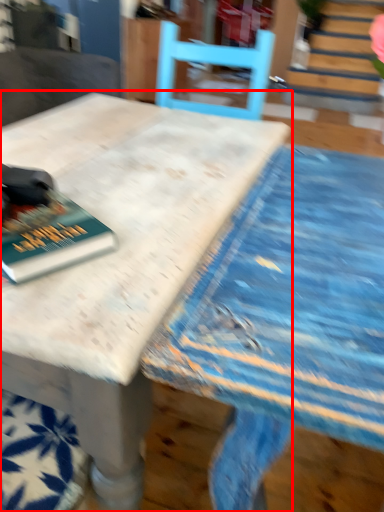
Question: From the image's perspective, where is table (annotated by the red box) located in relation to book in the image?

Choices:
 (A) above
 (B) below

Answer: (B)